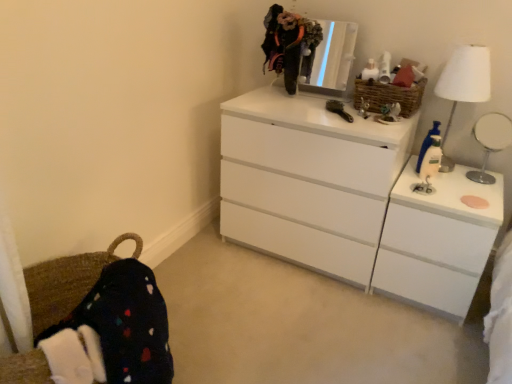
Question: Is white fabric lampshade at right oriented towards metallic reflective mirror at upper center?

Choices:
 (A) no
 (B) yes

Answer: (A)

Question: Considering the relative sizes of white fabric lampshade at right and metallic reflective mirror at upper center in the image provided, is white fabric lampshade at right wider than metallic reflective mirror at upper center?

Choices:
 (A) no
 (B) yes

Answer: (B)

Question: Does white fabric lampshade at right have a lesser height compared to metallic reflective mirror at upper center?

Choices:
 (A) no
 (B) yes

Answer: (A)

Question: Considering the relative sizes of white fabric lampshade at right and metallic reflective mirror at upper center in the image provided, is white fabric lampshade at right smaller than metallic reflective mirror at upper center?

Choices:
 (A) no
 (B) yes

Answer: (A)

Question: Considering the relative sizes of white fabric lampshade at right and metallic reflective mirror at upper center in the image provided, is white fabric lampshade at right taller than metallic reflective mirror at upper center?

Choices:
 (A) no
 (B) yes

Answer: (B)

Question: Is metallic reflective mirror at upper center completely or partially inside white fabric lampshade at right?

Choices:
 (A) yes
 (B) no

Answer: (B)

Question: Can you confirm if white glossy mirror at upper right is taller than fuzzy fabric at upper center?

Choices:
 (A) yes
 (B) no

Answer: (B)

Question: From the image's perspective, is white glossy mirror at upper right below fuzzy fabric at upper center?

Choices:
 (A) no
 (B) yes

Answer: (B)

Question: From a real-world perspective, is white glossy mirror at upper right positioned over fuzzy fabric at upper center based on gravity?

Choices:
 (A) no
 (B) yes

Answer: (A)

Question: Does white glossy mirror at upper right lie behind fuzzy fabric at upper center?

Choices:
 (A) no
 (B) yes

Answer: (A)

Question: Is white glossy mirror at upper right not within fuzzy fabric at upper center?

Choices:
 (A) yes
 (B) no

Answer: (A)

Question: Considering the relative sizes of white glossy mirror at upper right and fuzzy fabric at upper center in the image provided, is white glossy mirror at upper right smaller than fuzzy fabric at upper center?

Choices:
 (A) yes
 (B) no

Answer: (B)

Question: Is white glossy mirror at upper right not near blue plastic bottle at right?

Choices:
 (A) no
 (B) yes

Answer: (A)